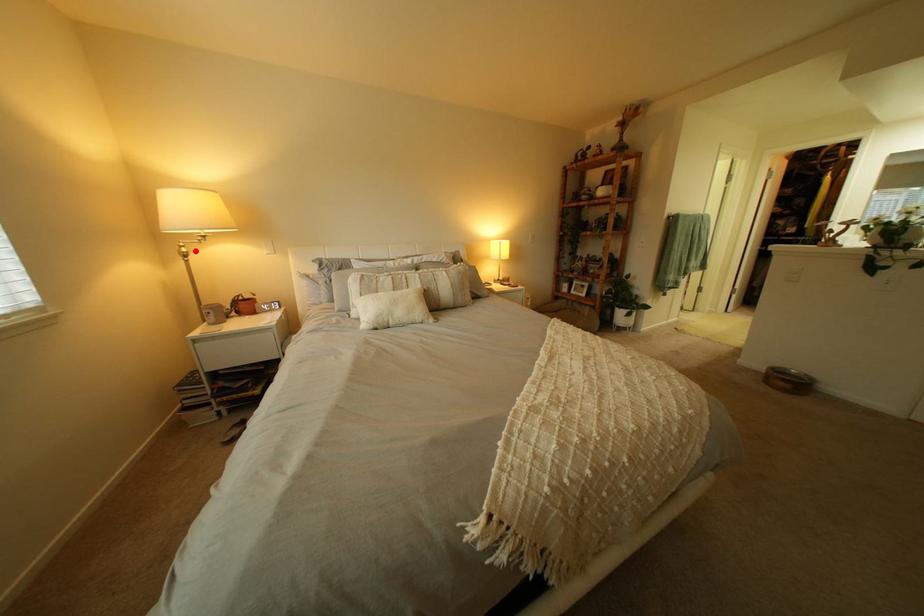
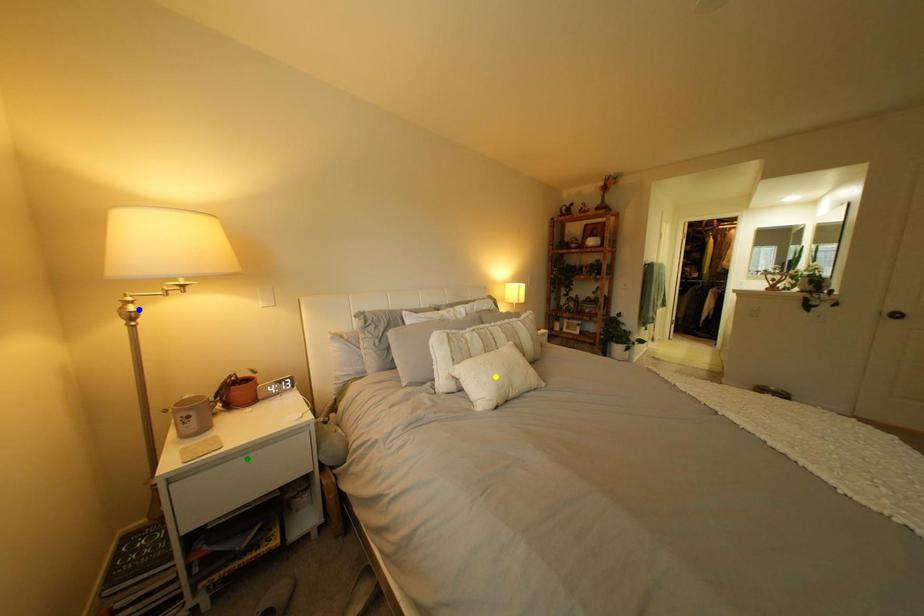
Question: I am providing you with two images of the same scene from different viewpoints. A red point is marked on the first image. You are given multiple points on the second image. Which point in image 2 is actually the same real-world point as the red point in image 1?

Choices:
 (A) blue point
 (B) green point
 (C) yellow point

Answer: (A)